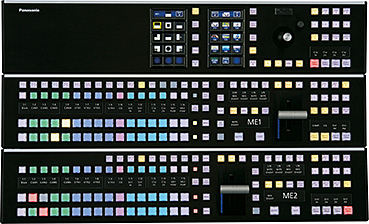
You are a GUI agent. You are given a task and a screenshot of the screen. Output one action in this format:
    pyautogui.click(x=<x>, y=<y>)
    Task: Click on the silver gray bar
    The image size is (369, 224).
    Given the screenshot: What is the action you would take?
    pyautogui.click(x=235, y=188), pyautogui.click(x=293, y=114)